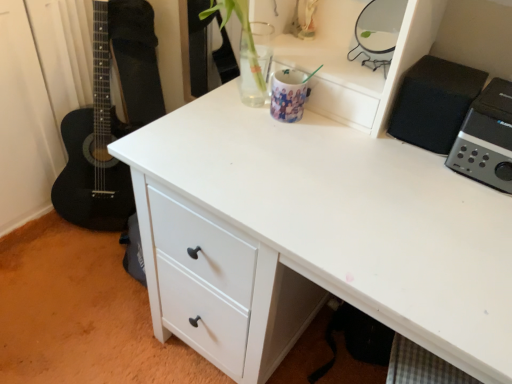
Question: Is black matte speaker at upper right, the second appliance from the right, directly adjacent to glossy ceramic mug at upper center, marked as the first appliance in a left-to-right arrangement?

Choices:
 (A) yes
 (B) no

Answer: (B)

Question: Is glossy ceramic mug at upper center, arranged as the fourth appliance when viewed from the right, surrounded by black matte speaker at upper right, the second appliance from the right?

Choices:
 (A) yes
 (B) no

Answer: (B)

Question: Is black matte speaker at upper right, the second appliance from the right, to the right of glossy ceramic mug at upper center, marked as the first appliance in a left-to-right arrangement, from the viewer's perspective?

Choices:
 (A) yes
 (B) no

Answer: (A)

Question: Is black matte speaker at upper right, which ranks as the third appliance in left-to-right order, positioned before glossy ceramic mug at upper center, marked as the first appliance in a left-to-right arrangement?

Choices:
 (A) no
 (B) yes

Answer: (B)

Question: From a real-world perspective, is black matte speaker at upper right, the second appliance from the right, positioned under glossy ceramic mug at upper center, marked as the first appliance in a left-to-right arrangement, based on gravity?

Choices:
 (A) no
 (B) yes

Answer: (A)

Question: Considering the relative sizes of black matte speaker at upper right, the second appliance from the right, and glossy ceramic mug at upper center, marked as the first appliance in a left-to-right arrangement, in the image provided, is black matte speaker at upper right, the second appliance from the right, wider than glossy ceramic mug at upper center, marked as the first appliance in a left-to-right arrangement,?

Choices:
 (A) yes
 (B) no

Answer: (A)

Question: Is metallic silver mirror at upper right, acting as the 3th appliance starting from the right, touching glossy ceramic mug at upper center, marked as the first appliance in a left-to-right arrangement?

Choices:
 (A) yes
 (B) no

Answer: (B)

Question: Is metallic silver mirror at upper right, acting as the 3th appliance starting from the right, surrounding glossy ceramic mug at upper center, marked as the first appliance in a left-to-right arrangement?

Choices:
 (A) no
 (B) yes

Answer: (A)

Question: Would you say metallic silver mirror at upper right, acting as the 2th appliance starting from the left, is outside glossy ceramic mug at upper center, arranged as the fourth appliance when viewed from the right?

Choices:
 (A) yes
 (B) no

Answer: (A)

Question: Considering the relative sizes of metallic silver mirror at upper right, acting as the 2th appliance starting from the left, and glossy ceramic mug at upper center, arranged as the fourth appliance when viewed from the right, in the image provided, is metallic silver mirror at upper right, acting as the 2th appliance starting from the left, smaller than glossy ceramic mug at upper center, arranged as the fourth appliance when viewed from the right,?

Choices:
 (A) no
 (B) yes

Answer: (A)

Question: Is metallic silver mirror at upper right, acting as the 3th appliance starting from the right, further to camera compared to glossy ceramic mug at upper center, arranged as the fourth appliance when viewed from the right?

Choices:
 (A) no
 (B) yes

Answer: (A)

Question: From a real-world perspective, does metallic silver mirror at upper right, acting as the 2th appliance starting from the left, sit lower than glossy ceramic mug at upper center, arranged as the fourth appliance when viewed from the right?

Choices:
 (A) yes
 (B) no

Answer: (B)

Question: From the image's perspective, is metallic silver mirror at upper right, acting as the 3th appliance starting from the right, beneath silver metallic speaker at upper right, which ranks as the 1th appliance in right-to-left order?

Choices:
 (A) no
 (B) yes

Answer: (A)